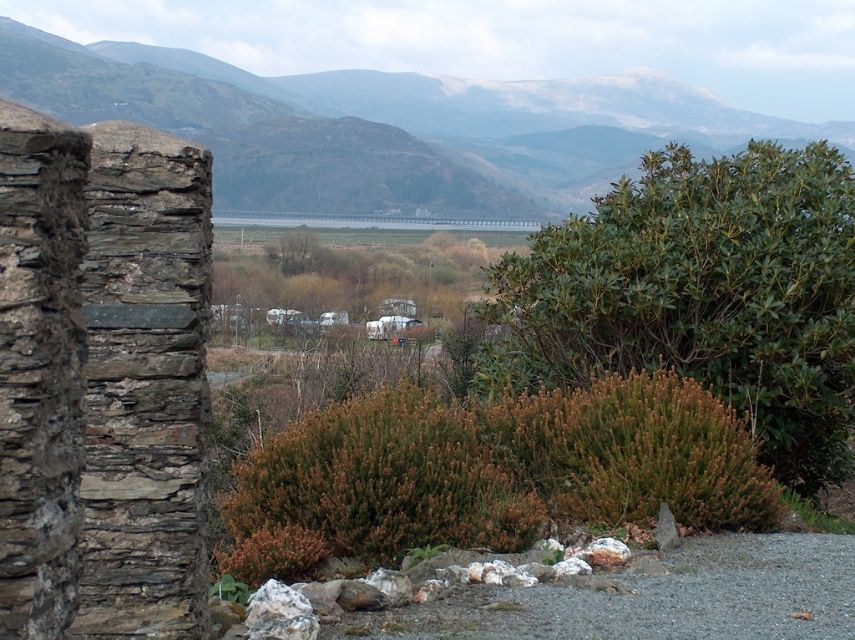
You are planning to place a small garden ornament between the green leafy bush at upper right and the green grassy mountain at upper center. Based on their widths, which object should you position the ornament closer to?

Since the green leafy bush at upper right is narrower than the green grassy mountain at upper center, you should position the ornament closer to the green leafy bush at upper right to ensure it is centered between them.

You are standing at the point marked as point [700,296] in the image. What do you see directly in front of you?

You see a green leafy bush at upper right directly in front of you at point [700,296].